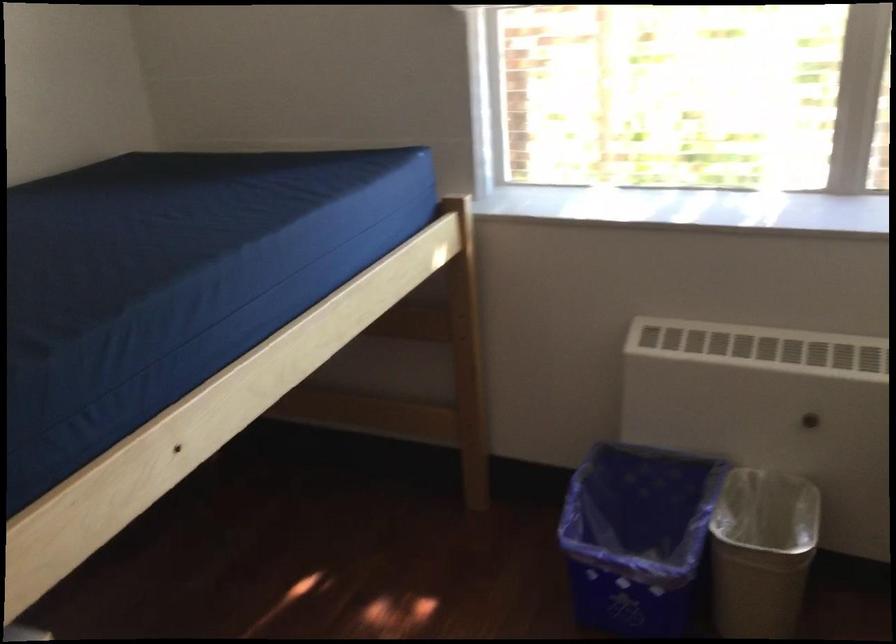
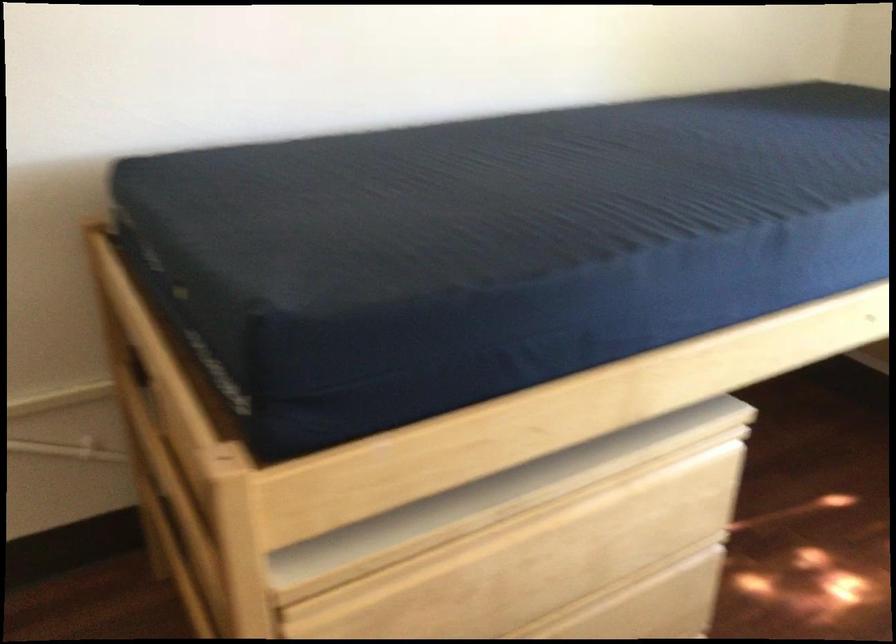
Question: The first image is from the beginning of the video and the second image is from the end. How did the camera likely rotate when shooting the video?

Choices:
 (A) Left
 (B) Right
 (C) Up
 (D) Down

Answer: (A)